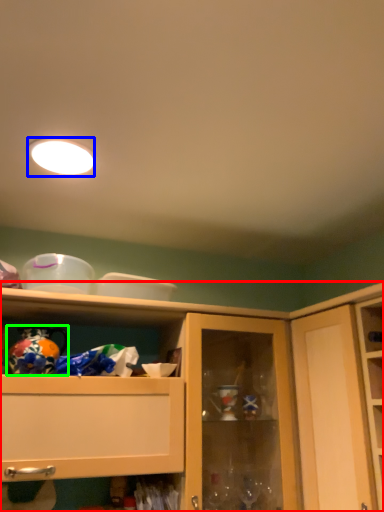
Question: Estimate the real-world distances between objects in this image. Which object is closer to cabinetry (highlighted by a red box), lighting (highlighted by a blue box) or toy (highlighted by a green box)?

Choices:
 (A) lighting
 (B) toy

Answer: (B)